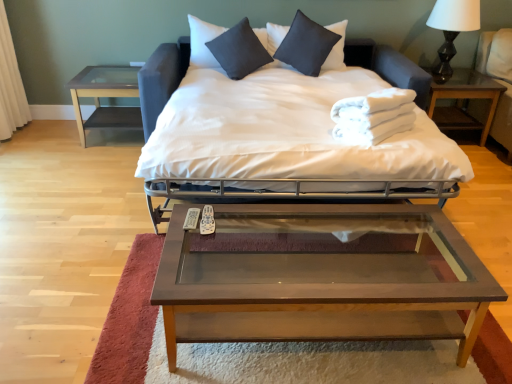
Where is `empty space that is in between clear glass table at left, which appears as the 2th nightstand when viewed from the right, and white fabric bed at center`? The height and width of the screenshot is (384, 512). empty space that is in between clear glass table at left, which appears as the 2th nightstand when viewed from the right, and white fabric bed at center is located at coordinates (103, 180).